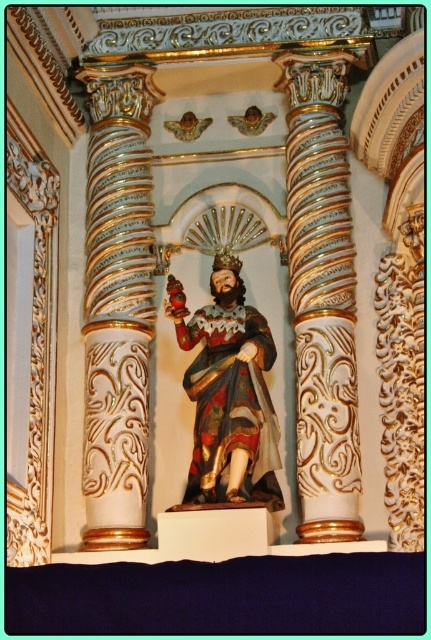
Between point (331, 465) and point (252, 456), which one is positioned in front?

Point (331, 465) is more forward.

Is the position of white glossy column at center more distant than that of wooden statue at center?

That is True.

Locate an element on the screen. The width and height of the screenshot is (431, 640). white glossy column at center is located at coordinates (321, 294).

Can you confirm if white glossy column at left is positioned to the left of wooden statue at center?

Indeed, white glossy column at left is positioned on the left side of wooden statue at center.

Who is more forward, (119, 332) or (246, 364)?

Point (246, 364) is in front.

Between point (121, 147) and point (249, 417), which one is positioned in front?

Point (249, 417) is more forward.

The height and width of the screenshot is (640, 431). In order to click on white glossy column at left in this screenshot , I will do `click(118, 305)`.

Which of these two, white glossy column at left or white glossy column at center, stands taller?

With more height is white glossy column at left.

Describe the element at coordinates (118, 305) in the screenshot. I see `white glossy column at left` at that location.

Identify the location of white glossy column at left. The image size is (431, 640). (118, 305).